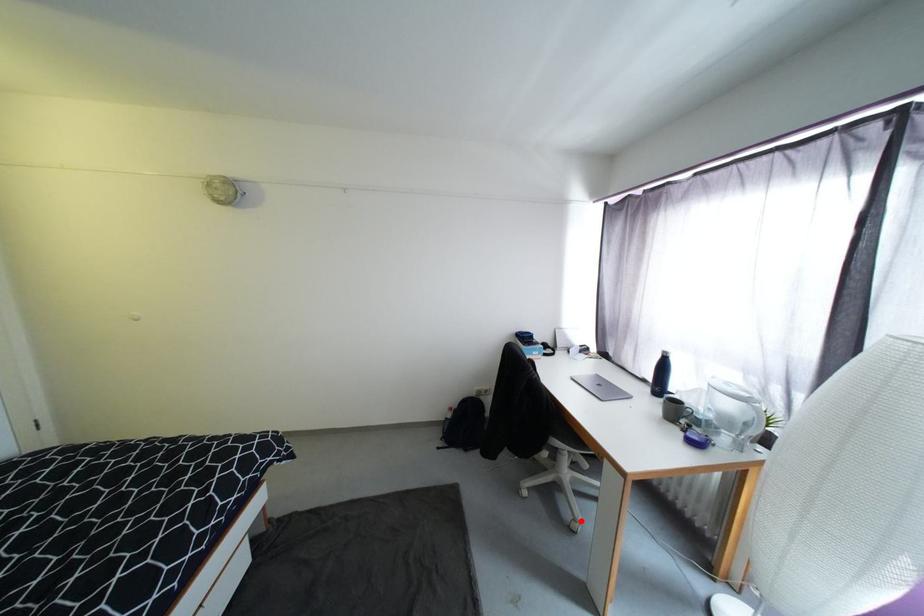
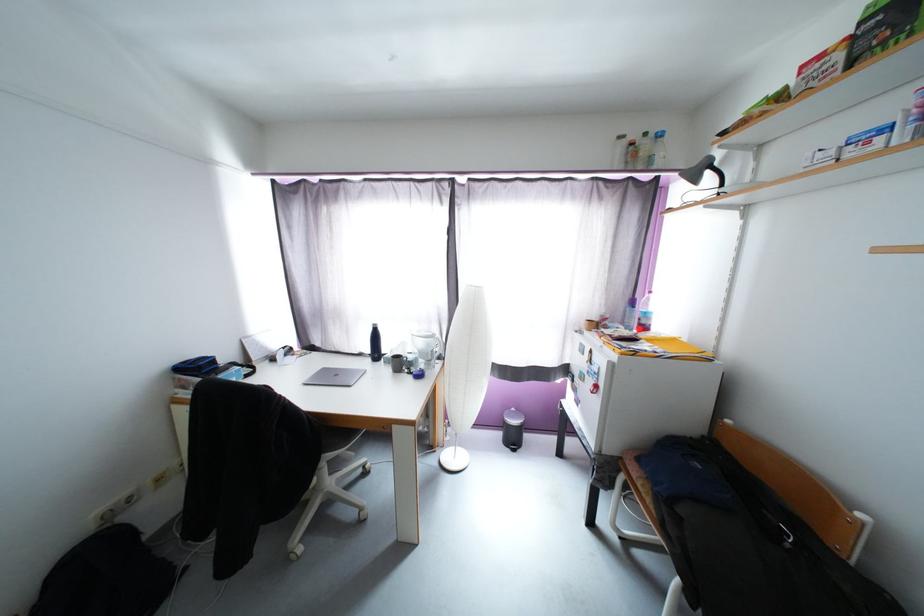
Find the pixel in the second image that matches the highlighted location in the first image.

(367, 511)